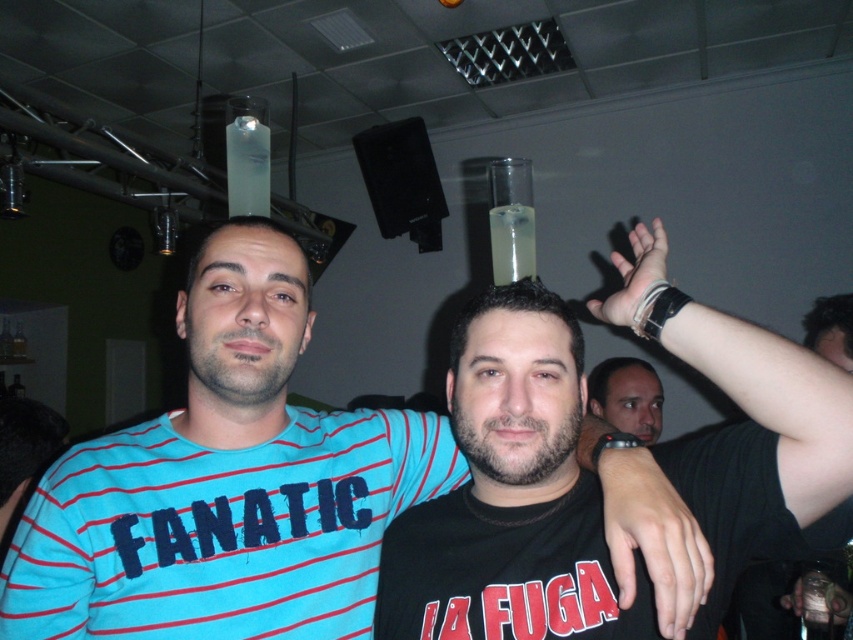
You are at a party and want to introduce yourself to the person wearing the black matte shirt at center. Which side of the smooth skin face at center should you approach from?

The black matte shirt at center is to the left of the smooth skin face at center, so you should approach from the right side of the smooth skin face at center to reach the person wearing the black matte shirt at center.

You are a photographer at the event and want to capture a closeup of the black matte shirt at center and the smooth skin face at center. Which object should you focus on first if you want to ensure both are in focus, considering their sizes?

The black matte shirt at center is bigger than the smooth skin face at center, so you should focus on the black matte shirt at center first to ensure both are in focus.

You are a photographer trying to capture a candid shot of the smooth skin face at center and the black matte shirt at center. Since you want to focus on the face, which object should you adjust your camera to prioritize in terms of depth of field?

The black matte shirt at center is closer to the viewer than the smooth skin face at center, so to prioritize the face, you should adjust the camera to focus on the smooth skin face at center, ensuring it is in sharp focus while the shirt may be slightly blurred due to the depth of field.